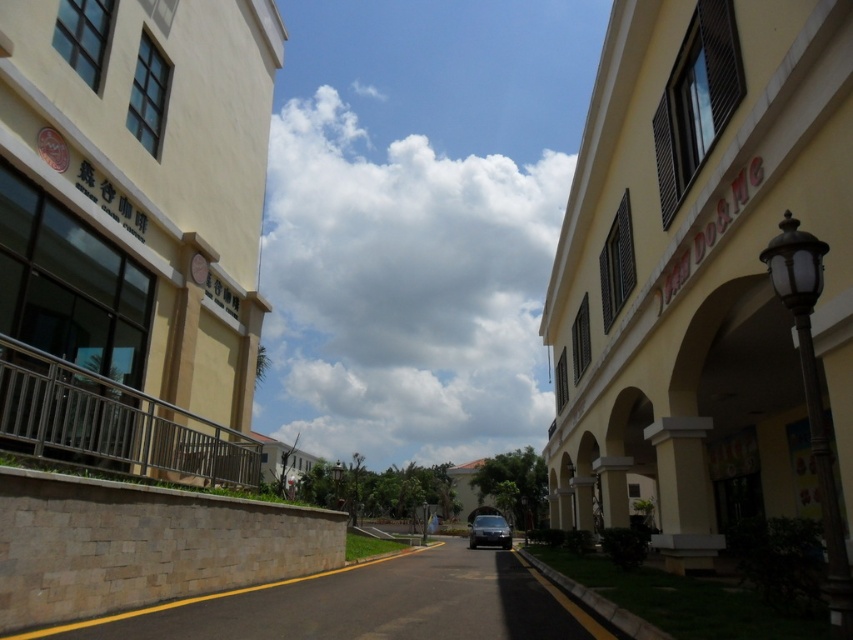
You are a delivery driver who needs to park your vehicle on the black asphalt road at center. However, there is a yellow matte building at right nearby. Can you fit your vehicle there without touching the building?

The yellow matte building at right is larger than the black asphalt road at center, so there might not be enough space to park without touching the building.

You are standing on the sidewalk and want to walk towards the yellow matte building at right and the black asphalt road at center. Which one will you reach first?

You will reach the yellow matte building at right first because it is closer to you than the black asphalt road at center.

You are standing at the origin point of the coordinate system. You want to walk to the yellow matte building at right. Which direction should you move in?

The yellow matte building at right is located at coordinate point 0.419 on the x axis and 0.822 on the y axis. Since you are at the origin, you should move in the positive x and positive y direction to reach it.